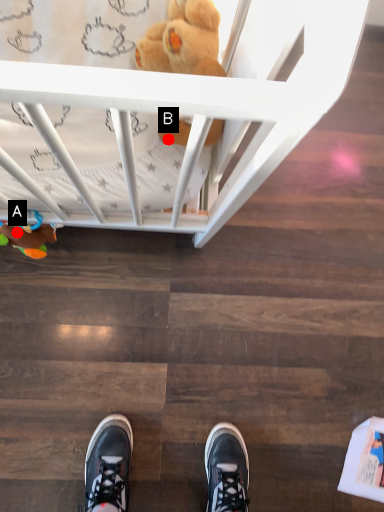
Question: Two points are circled on the image, labeled by A and B beside each circle. Which point is further to the camera?

Choices:
 (A) A is further
 (B) B is further

Answer: (A)